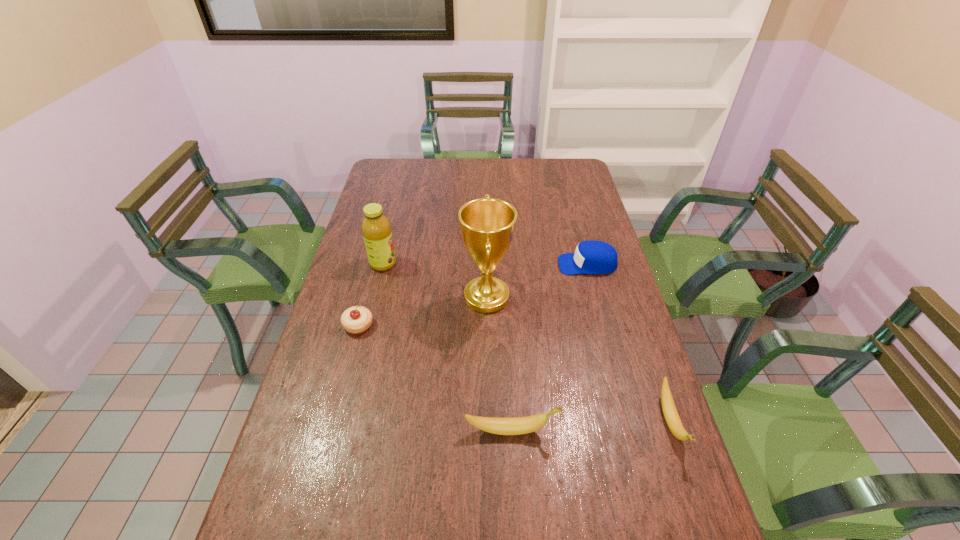
In the image, there is a desktop. Where is `vacant space at the far edge`? vacant space at the far edge is located at coordinates (449, 162).

In the image, there is a desktop. Where is `free space at the left edge`? The width and height of the screenshot is (960, 540). free space at the left edge is located at coordinates (385, 186).

Image resolution: width=960 pixels, height=540 pixels. Identify the location of free region at the right edge of the desktop. (587, 191).

The height and width of the screenshot is (540, 960). What are the coordinates of `vacant space at the far left corner of the desktop` in the screenshot? It's located at [x=383, y=170].

What are the coordinates of `vacant position at the near left corner of the desktop` in the screenshot? It's located at (320, 501).

Where is `free space at the near right corner of the desktop`? The width and height of the screenshot is (960, 540). free space at the near right corner of the desktop is located at coordinates (704, 537).

Identify the location of empty location between the award and the third tallest object. (498, 364).

Where is `vacant space in between the fourth shortest object and the award`? vacant space in between the fourth shortest object and the award is located at coordinates pyautogui.click(x=498, y=364).

Find the location of `empty space between the shortest object and the fruit juice`. empty space between the shortest object and the fruit juice is located at coordinates (371, 294).

The height and width of the screenshot is (540, 960). What are the coordinates of `free space between the tallest object and the baseball cap` in the screenshot? It's located at (537, 281).